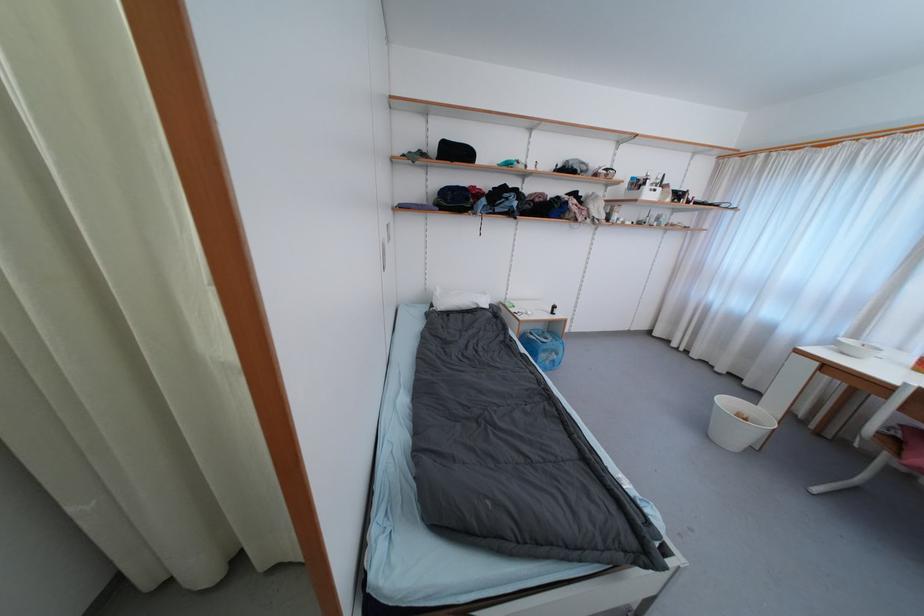
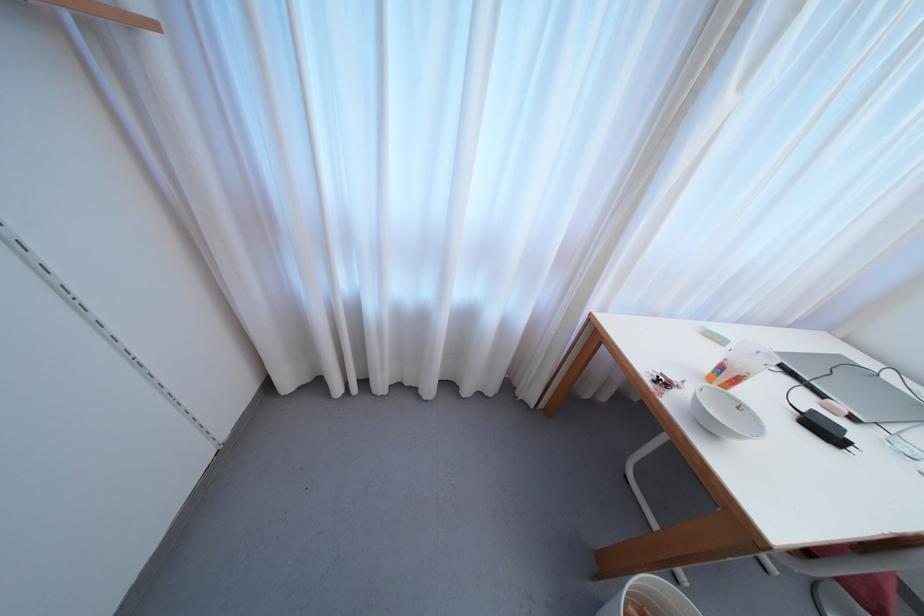
In the second image, find the point that corresponds to the point at 677,347 in the first image.

(342, 392)